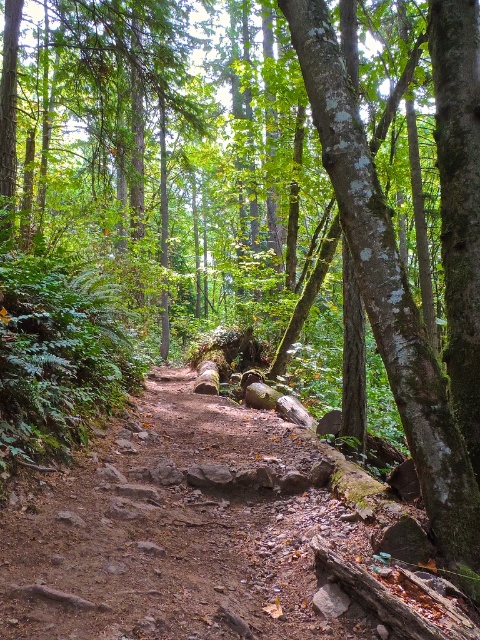
Question: Is dirt path at center to the right of green mossy tree trunk at right from the viewer's perspective?

Choices:
 (A) no
 (B) yes

Answer: (A)

Question: Can you confirm if dirt path at center is thinner than green mossy tree trunk at right?

Choices:
 (A) yes
 (B) no

Answer: (B)

Question: Which object appears farthest from the camera in this image?

Choices:
 (A) green mossy tree trunk at right
 (B) dirt path at center

Answer: (A)

Question: Among these objects, which one is nearest to the camera?

Choices:
 (A) green mossy tree trunk at right
 (B) dirt path at center

Answer: (B)

Question: Which object appears closest to the camera in this image?

Choices:
 (A) green mossy tree trunk at right
 (B) dirt path at center

Answer: (B)

Question: Is dirt path at center to the left of green mossy tree trunk at right from the viewer's perspective?

Choices:
 (A) no
 (B) yes

Answer: (B)